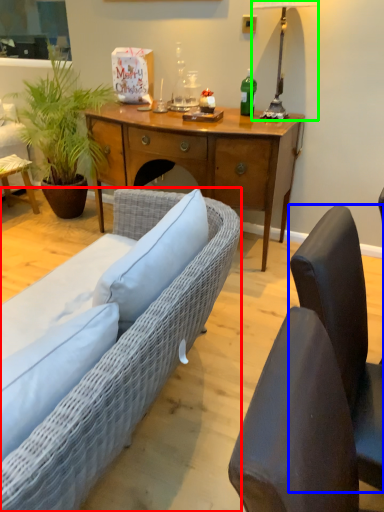
Question: Considering the real-world distances, which object is closest to studio couch (highlighted by a red box)? chair (highlighted by a blue box) or lamp (highlighted by a green box).

Choices:
 (A) chair
 (B) lamp

Answer: (A)